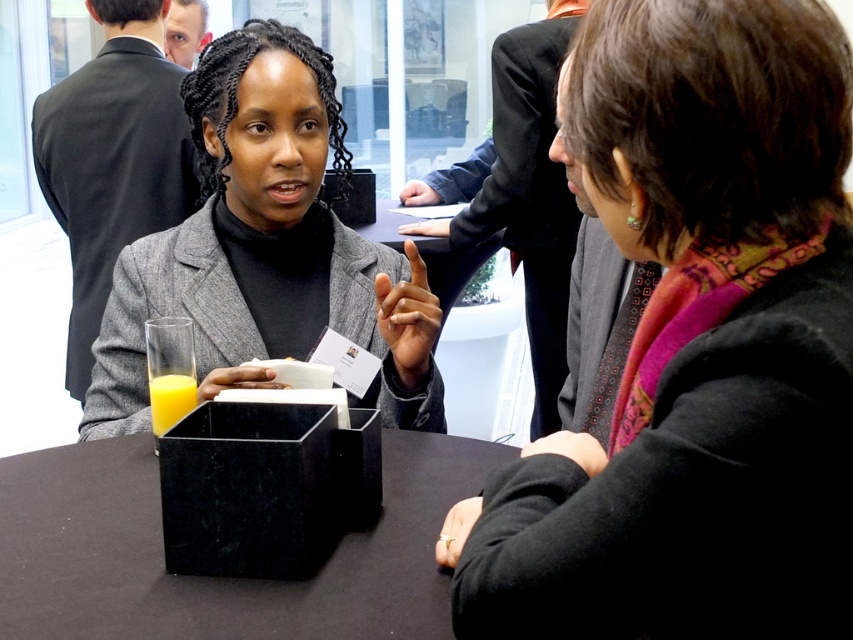
You are attending a networking event and need to place a name tag on the table. The name tag must be placed in front of the translucent glass at lower left. Can you place it on the black matte box at center?

The black matte box at center is already in front of the translucent glass at lower left, so placing the name tag on the black matte box at center would satisfy the requirement.

You are at a networking event and see two items on the table between the two people talking. The items are the black matte box at center and the gold metallic ring at lower center. Which one is positioned to the left of the other?

The black matte box at center is to the left of the gold metallic ring at lower center.

From the picture: You are standing at the entrance of the conference room and see a point marked at coordinates (254, 621). If you want to place a 20 inch wide laptop on the table near that point, will there be enough space between the point and the edge of the table?

The distance of point (254, 621) from viewer is 31.82 inches. Since the laptop is 20 inches wide, there is sufficient space as 31.82 inches is greater than 20 inches.